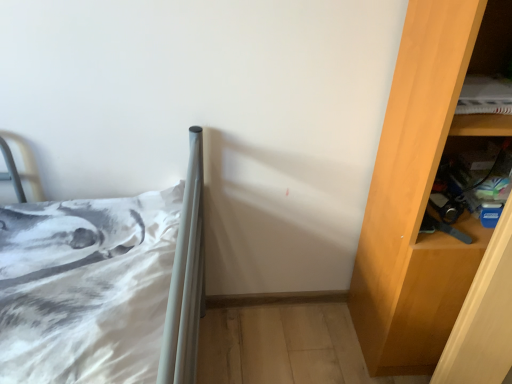
The width and height of the screenshot is (512, 384). What do you see at coordinates (464, 186) in the screenshot? I see `wooden cabinet at right` at bounding box center [464, 186].

You are a GUI agent. You are given a task and a screenshot of the screen. Output one action in this format:
    pyautogui.click(x=<x>, y=<y>)
    Task: Click on the wooden cabinet at right
    This screenshot has height=384, width=512.
    Given the screenshot: What is the action you would take?
    pyautogui.click(x=464, y=186)

At what (x,y) coordinates should I click in order to perform the action: click on wooden cabinet at right. Please return your answer as a coordinate pair (x, y). The image size is (512, 384). Looking at the image, I should click on 464,186.